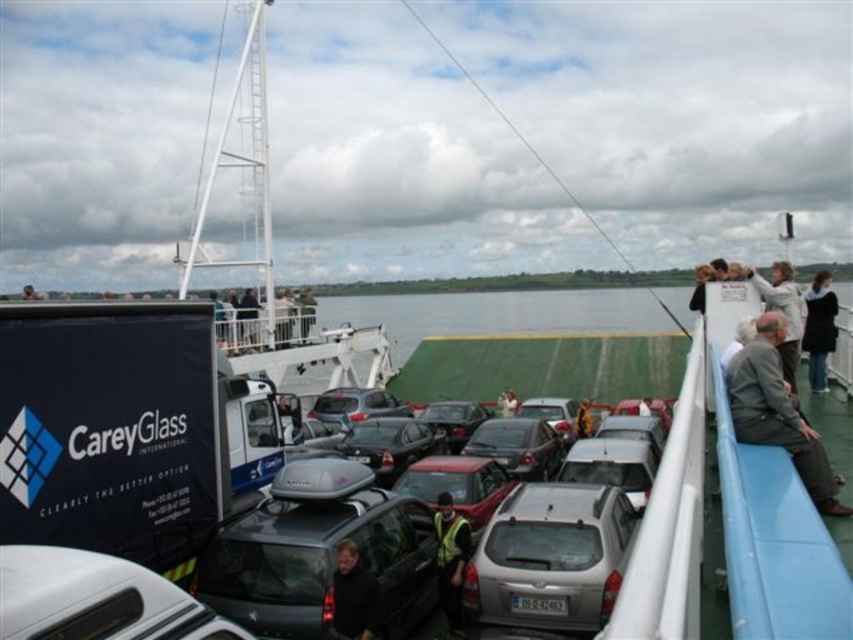
Question: Which object appears closest to the camera in this image?

Choices:
 (A) dark blue jacket at upper right
 (B) matte gray car at center
 (C) white glossy car at lower left

Answer: (C)

Question: Is white glossy car at lower left above gray fabric jacket at right?

Choices:
 (A) yes
 (B) no

Answer: (B)

Question: Which object is farther from the camera taking this photo?

Choices:
 (A) black fabric jacket at center
 (B) satin silver car at center
 (C) gray fabric jacket at right
 (D) yellow reflective vest at center

Answer: (D)

Question: Does yellow reflective vest at center appear over dark blue jacket at upper right?

Choices:
 (A) yes
 (B) no

Answer: (B)

Question: Does dark blue jacket at upper right have a lesser width compared to light brown leather jacket at upper right?

Choices:
 (A) no
 (B) yes

Answer: (A)

Question: Which of these objects is positioned farthest from the light brown leather jacket at upper right?

Choices:
 (A) metallic silver car at center
 (B) satin silver car at center

Answer: (A)